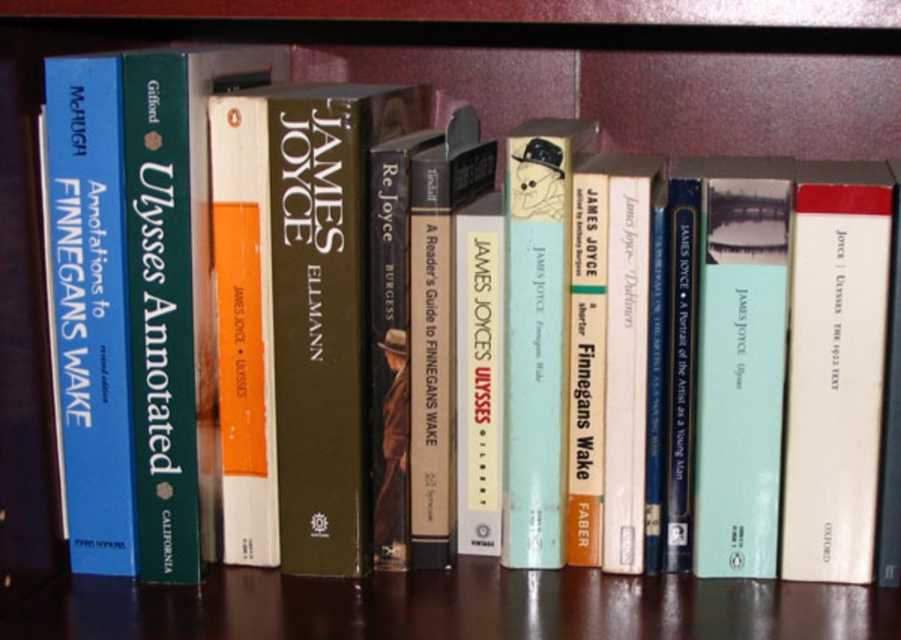
Between wooden table at center and white paper at center, which one appears on the right side from the viewer's perspective?

white paper at center

Which of these two, wooden table at center or white paper at center, stands shorter?

wooden table at center

The height and width of the screenshot is (640, 901). What do you see at coordinates (453, 608) in the screenshot?
I see `wooden table at center` at bounding box center [453, 608].

Locate an element on the screen. This screenshot has width=901, height=640. wooden table at center is located at coordinates (453, 608).